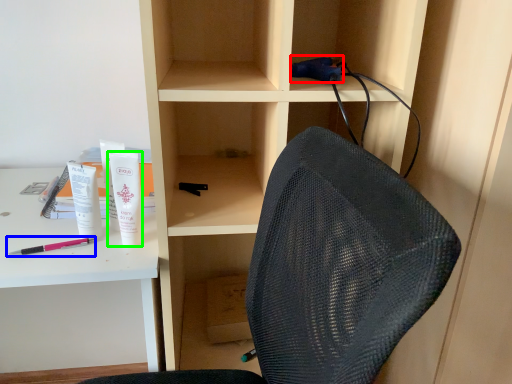
Question: Which object is positioned farthest from stationery (highlighted by a red box)? Select from pencil (highlighted by a blue box) and toiletry (highlighted by a green box).

Choices:
 (A) pencil
 (B) toiletry

Answer: (A)